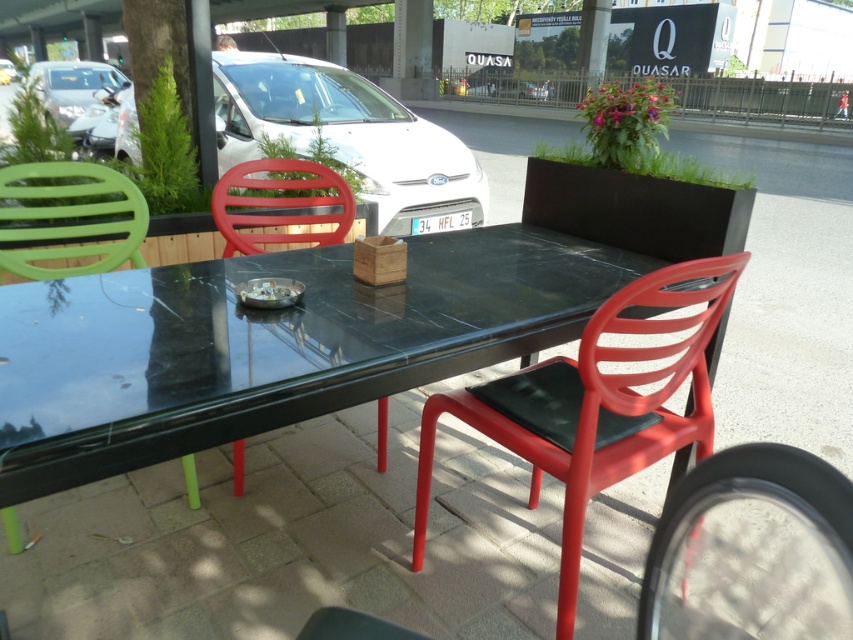
You are designing a new outdoor seating arrangement and want to ensure that the glossy black table at center can fit through the entrance door which has a width of 1.2 meters. Given that the white glossy car at upper center is parked nearby and is wider than the table, can the table pass through the door?

The glossy black table at center is thinner than the white glossy car at upper center. Since the car is wider, the table should fit through the 1.2 meter door if the car itself can pass, but this depends on the car width. However, without knowing the exact dimensions, we can only confirm the table is narrower than the car.

You are a customer entering the outdoor seating area and see the matte green chair at left and the metallic silver car at upper left. Which object is closer to the entrance of the seating area?

The metallic silver car at upper left is closer to the entrance because it is positioned to the left of the matte green chair at left, which is further away.